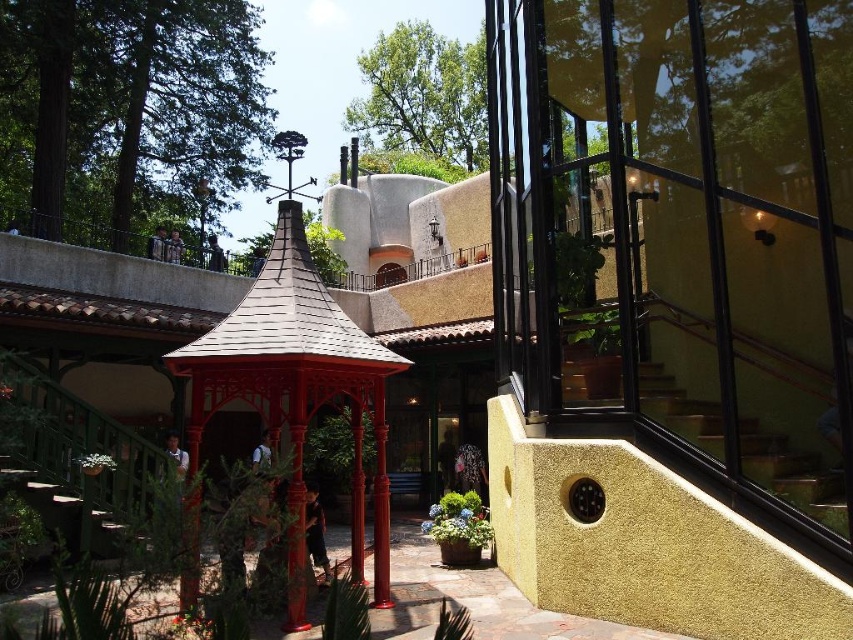
You are standing in the outdoor scene and want to take a photo of the matte red gazebo at center. If your camera can focus up to 5 meters, will you need to move closer to get a clear shot?

The matte red gazebo at center is 5.49 meters away from the camera. Since the camera can only focus up to 5 meters, you will need to move closer to ensure the gazebo is in focus.

You are standing in the outdoor area and want to take a photo of the matte red gazebo at center. To avoid having the green leafy tree at upper left blocking the view, should you position yourself closer to or farther away from the gazebo?

The green leafy tree at upper left is taller than the matte red gazebo at center. To avoid the tree blocking the view, you should position yourself farther away from the gazebo so that the tree appears smaller in the frame relative to the gazebo.

You are planning to install a new pathway between the green leafy tree at upper left and the matte red gazebo at center. The pathway requires a minimum of 40 feet of space. Based on the scene, will there be enough space to install the pathway?

The green leafy tree at upper left and matte red gazebo at center are 43.16 feet apart, which exceeds the required 40 feet, so the pathway can be installed between them.